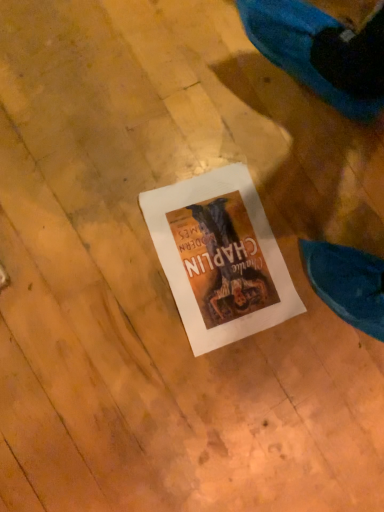
Where is `vacant space to the right of white paper poster at center`? vacant space to the right of white paper poster at center is located at coordinates [x=306, y=373].